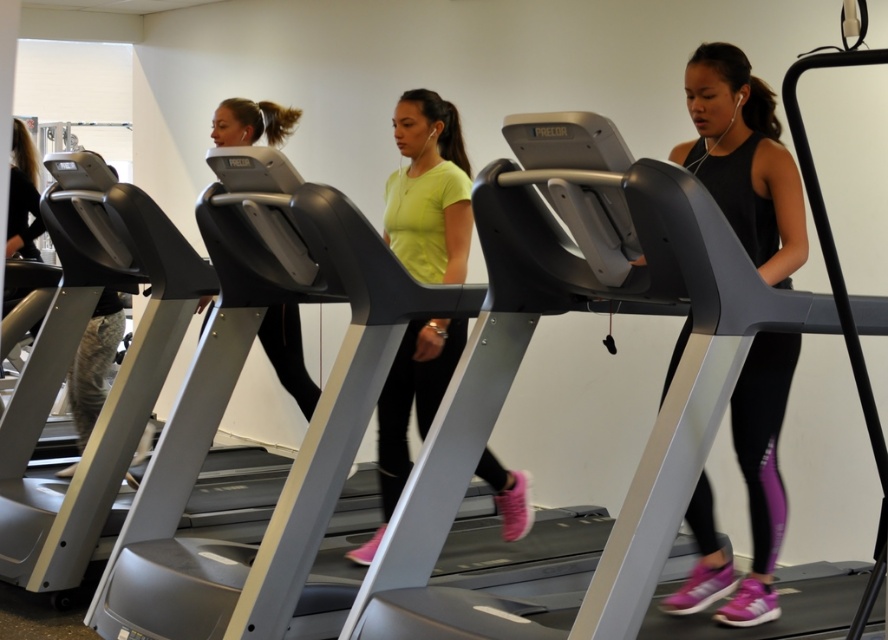
Between black matte tank top at center and matte black treadmill at center, which one is positioned higher?

black matte tank top at center is higher up.

Locate an element on the screen. black matte tank top at center is located at coordinates (744, 160).

The width and height of the screenshot is (888, 640). What are the coordinates of `black matte tank top at center` in the screenshot? It's located at (744, 160).

Who is positioned more to the right, neon yellow t-shirt at center or matte black treadmill at center?

From the viewer's perspective, neon yellow t-shirt at center appears more on the right side.

Can you confirm if neon yellow t-shirt at center is shorter than matte black treadmill at center?

In fact, neon yellow t-shirt at center may be taller than matte black treadmill at center.

Does point (395, 417) come closer to viewer compared to point (270, 317)?

Yes, it is.

Where is `neon yellow t-shirt at center`? This screenshot has height=640, width=888. neon yellow t-shirt at center is located at coordinates (429, 189).

Who is shorter, black matte tank top at center or neon yellow t-shirt at center?

With less height is black matte tank top at center.

Can you confirm if black matte tank top at center is wider than neon yellow t-shirt at center?

In fact, black matte tank top at center might be narrower than neon yellow t-shirt at center.

Where is `black matte tank top at center`? black matte tank top at center is located at coordinates (744, 160).